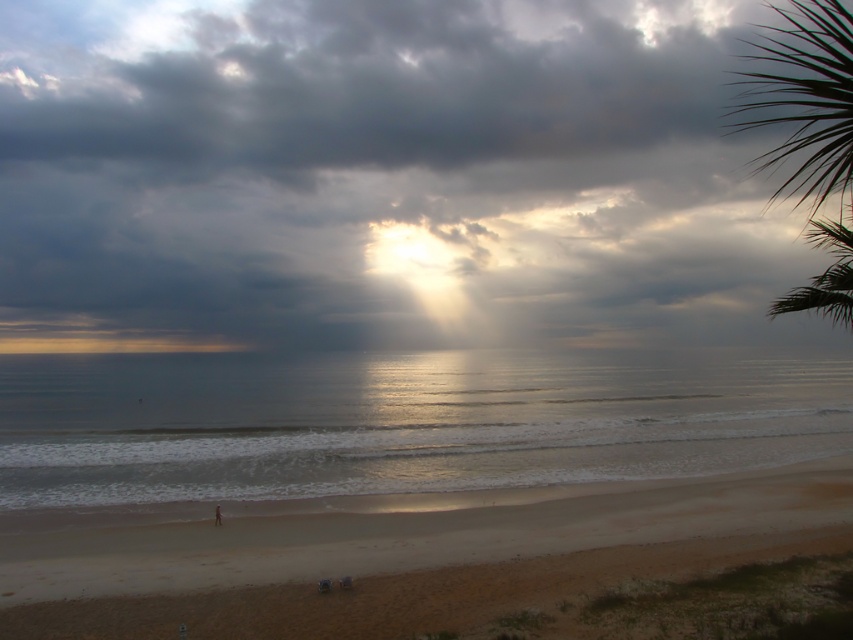
Question: Is brown sandy beach at lower center behind green leafy palm tree at upper right?

Choices:
 (A) yes
 (B) no

Answer: (A)

Question: Does dark gray cloud at upper center appear on the left side of green leafy palm tree at upper right?

Choices:
 (A) yes
 (B) no

Answer: (A)

Question: Among these objects, which one is farthest from the camera?

Choices:
 (A) brown sandy beach at lower center
 (B) dark gray cloud at upper center
 (C) green leafy palm tree at upper right
 (D) smooth blue water at center

Answer: (D)

Question: Can you confirm if dark gray cloud at upper center is wider than green leafy palm tree at upper right?

Choices:
 (A) no
 (B) yes

Answer: (B)

Question: Which point is farther from the camera taking this photo?

Choices:
 (A) (834, 428)
 (B) (604, 584)
 (C) (813, 1)

Answer: (A)

Question: Which point is closer to the camera taking this photo?

Choices:
 (A) click(201, 390)
 (B) click(782, 296)

Answer: (B)